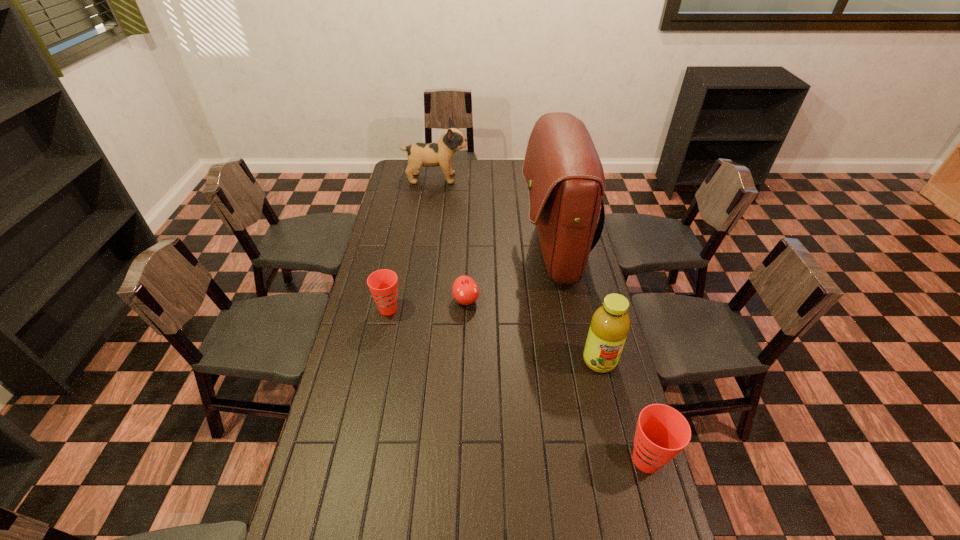
Image resolution: width=960 pixels, height=540 pixels. In order to click on vacant region located 0.350m at the face of the puppy in this screenshot , I will do `click(535, 178)`.

Locate an element on the screen. Image resolution: width=960 pixels, height=540 pixels. free region located on the front label of the fruit juice is located at coordinates (614, 422).

Image resolution: width=960 pixels, height=540 pixels. I want to click on vacant space positioned on the open flap of the tallest object, so click(x=464, y=252).

What are the coordinates of `vacant space located 0.280m on the open flap of the tallest object` in the screenshot? It's located at (454, 252).

Find the location of `vacant space located 0.140m on the open flap of the tallest object`. vacant space located 0.140m on the open flap of the tallest object is located at coordinates (488, 252).

This screenshot has width=960, height=540. What are the coordinates of `free spot located on the right of the apple` in the screenshot? It's located at (562, 300).

Where is `object that is positioned at the far edge`? object that is positioned at the far edge is located at coordinates (440, 153).

Locate an element on the screen. This screenshot has width=960, height=540. cup present at the left edge is located at coordinates (383, 284).

At what (x,y) coordinates should I click in order to perform the action: click on puppy at the left edge. Please return your answer as a coordinate pair (x, y). Looking at the image, I should click on (440, 153).

What are the coordinates of `cup that is at the right edge` in the screenshot? It's located at (662, 432).